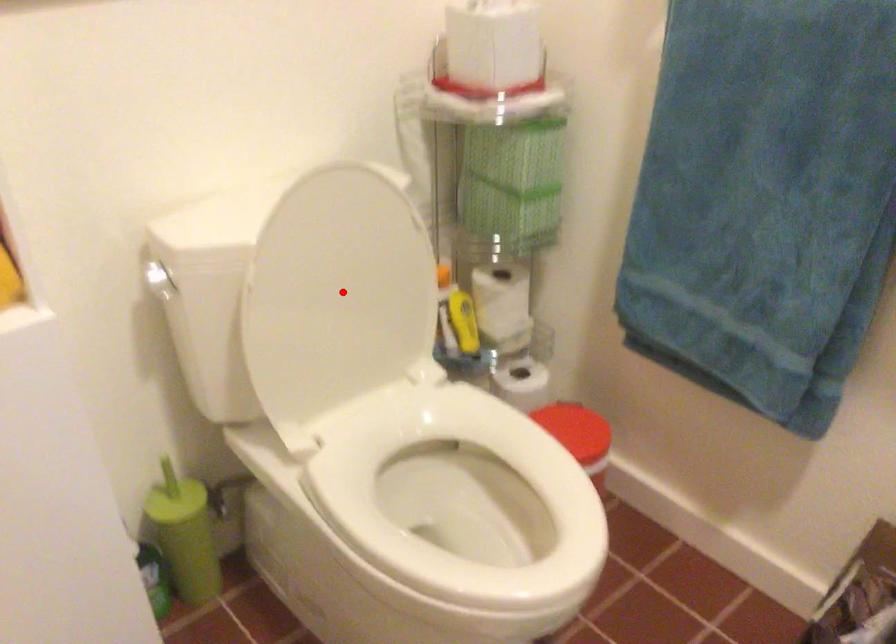
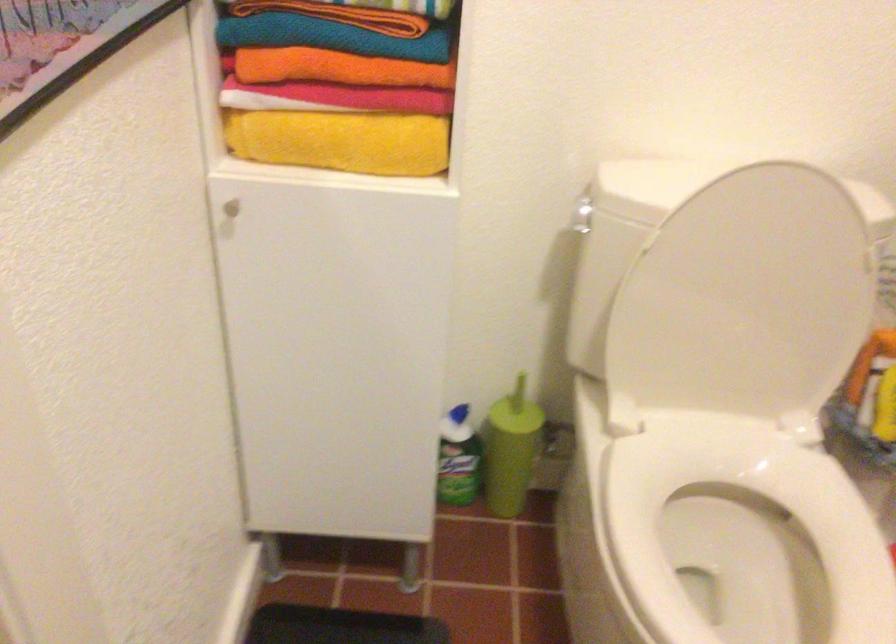
In the second image, find the point that corresponds to the highlighted location in the first image.

(744, 299)